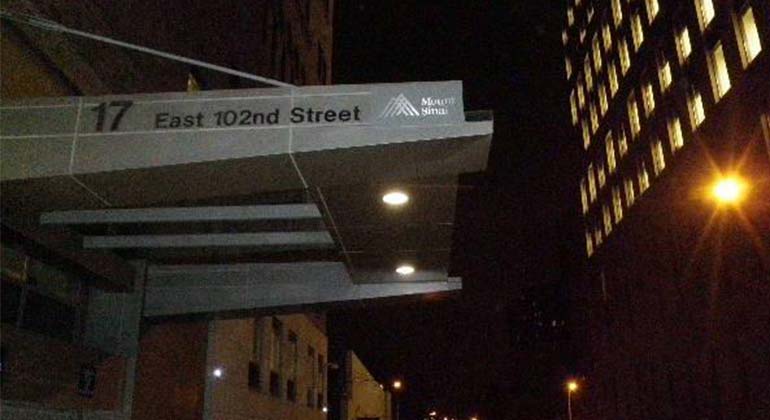
Identify the location of window. (750, 40), (715, 69), (693, 106), (677, 133).